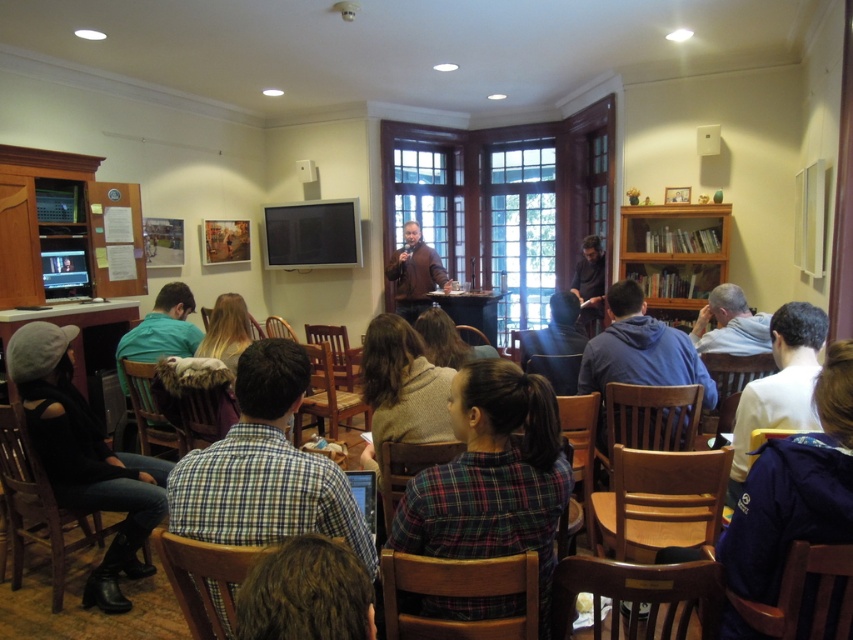
Does point (802, 612) lie behind point (403, 268)?

No, it is not.

Identify the location of purple fabric jacket at lower right. (793, 490).

The width and height of the screenshot is (853, 640). Find the location of `purple fabric jacket at lower right`. purple fabric jacket at lower right is located at coordinates (793, 490).

Identify the location of purple fabric jacket at lower right. This screenshot has height=640, width=853. (793, 490).

Measure the distance between wooden bookshelf at right and matte brown jacket at center.

wooden bookshelf at right and matte brown jacket at center are 2.03 meters apart from each other.

Consider the image. Does wooden bookshelf at right appear over matte brown jacket at center?

Indeed, wooden bookshelf at right is positioned over matte brown jacket at center.

You are a GUI agent. You are given a task and a screenshot of the screen. Output one action in this format:
    pyautogui.click(x=<x>, y=<y>)
    Task: Click on the wooden bookshelf at right
    This screenshot has height=640, width=853.
    Given the screenshot: What is the action you would take?
    pyautogui.click(x=675, y=253)

Who is higher up, blonde hair at center or wooden table at center?

wooden table at center is above.

Measure the distance between blonde hair at center and wooden table at center.

blonde hair at center is 3.05 meters from wooden table at center.

Does point (236, 349) come closer to viewer compared to point (461, 291)?

Yes.

Where is `blonde hair at center`? blonde hair at center is located at coordinates (225, 330).